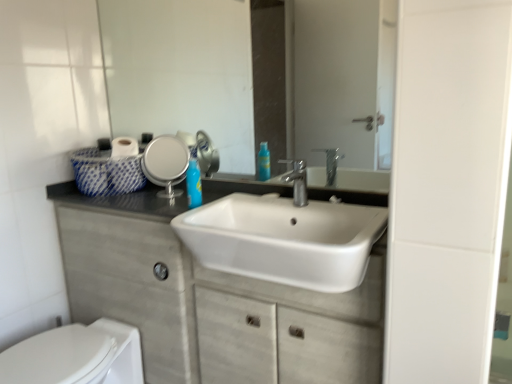
Question: Is white glossy sink at center in front of or behind white glossy toilet at lower left in the image?

Choices:
 (A) front
 (B) behind

Answer: (A)

Question: From the image's perspective, is white glossy sink at center positioned above or below white glossy toilet at lower left?

Choices:
 (A) below
 (B) above

Answer: (B)

Question: Which object is positioned farthest from the blue glossy soap dispenser at center?

Choices:
 (A) white glossy toilet at lower left
 (B) clear glass mirror at upper center
 (C) white glossy sink at center
 (D) silver metallic faucet at center
 (E) white matte cabinet at center

Answer: (B)

Question: Considering the real-world distances, which object is farthest from the clear glass mirror at upper center?

Choices:
 (A) blue glossy soap dispenser at center
 (B) silver metallic faucet at center
 (C) white glossy sink at center
 (D) white glossy toilet at lower left
 (E) white matte cabinet at center

Answer: (C)